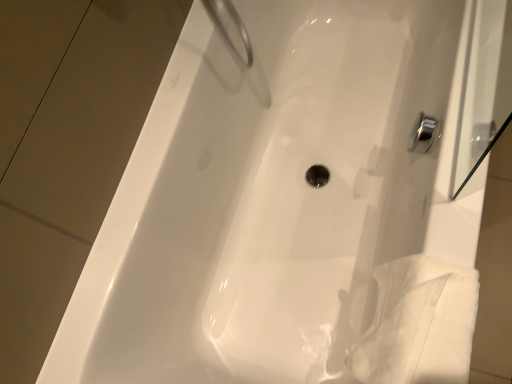
Identify the location of free space above white fabric towel at lower right (from a real-world perspective). This screenshot has width=512, height=384. (430, 323).